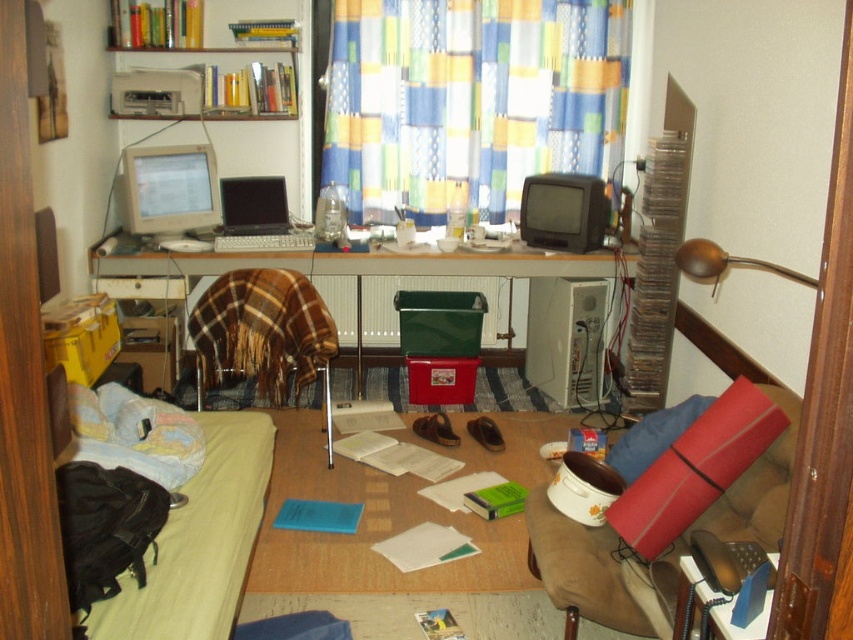
You are setting up a workspace and need to place a wireless keyboard that requires at least 10 inches of space between the monitor and laptop. Can the matte gray monitor at upper left and the matte black laptop at center accommodate this requirement?

The matte gray monitor at upper left and the matte black laptop at center are 9.26 inches apart from each other, which is less than the required 10 inches. Therefore, the wireless keyboard cannot be placed between them with the needed space.